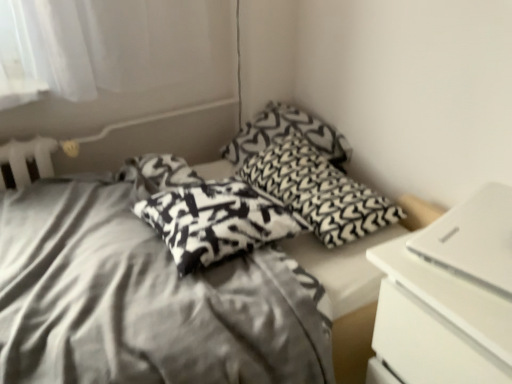
Describe the element at coordinates (318, 191) in the screenshot. I see `black and white patterned pillow at center, which ranks as the second pillow in back-to-front order` at that location.

What is the approximate width of silky fabric bed at center?

silky fabric bed at center is 1.01 meters in width.

Identify the location of black knitted pillow at center, placed as the third pillow when sorted from front to back. (286, 134).

Describe the element at coordinates (216, 221) in the screenshot. I see `black-and-white printed pillow at center, the third pillow from the back` at that location.

Locate an element on the screen. white matte laptop at right is located at coordinates (x=474, y=240).

Can you confirm if black knitted pillow at center, which is the 1th pillow in back-to-front order, is positioned to the left of black-and-white printed pillow at center, the third pillow from the back?

In fact, black knitted pillow at center, which is the 1th pillow in back-to-front order, is to the right of black-and-white printed pillow at center, the third pillow from the back.

Where is `pillow above the black-and-white printed pillow at center, acting as the 1th pillow starting from the front (from a real-world perspective)`? pillow above the black-and-white printed pillow at center, acting as the 1th pillow starting from the front (from a real-world perspective) is located at coordinates (286, 134).

From a real-world perspective, who is located higher, black knitted pillow at center, placed as the third pillow when sorted from front to back, or black-and-white printed pillow at center, acting as the 1th pillow starting from the front?

black knitted pillow at center, placed as the third pillow when sorted from front to back, is physically above.

Which of these two, black knitted pillow at center, which is the 1th pillow in back-to-front order, or black-and-white printed pillow at center, acting as the 1th pillow starting from the front, is smaller?

With smaller size is black-and-white printed pillow at center, acting as the 1th pillow starting from the front.

Which of these two, black-and-white printed pillow at center, acting as the 1th pillow starting from the front, or silky fabric bed at center, stands shorter?

With less height is black-and-white printed pillow at center, acting as the 1th pillow starting from the front.

From a real-world perspective, is black-and-white printed pillow at center, the third pillow from the back, under silky fabric bed at center?

No, from a real-world perspective, black-and-white printed pillow at center, the third pillow from the back, is not beneath silky fabric bed at center.

Which is in front, point (234, 223) or point (263, 302)?

Positioned in front is point (263, 302).

Is black-and-white printed pillow at center, acting as the 1th pillow starting from the front, wider than silky fabric bed at center?

In fact, black-and-white printed pillow at center, acting as the 1th pillow starting from the front, might be narrower than silky fabric bed at center.

From the image's perspective, is black-and-white printed pillow at center, the third pillow from the back, above black knitted pillow at center, placed as the third pillow when sorted from front to back?

Incorrect, from the image's perspective, black-and-white printed pillow at center, the third pillow from the back, is lower than black knitted pillow at center, placed as the third pillow when sorted from front to back.

From a real-world perspective, is black-and-white printed pillow at center, acting as the 1th pillow starting from the front, on top of black knitted pillow at center, which is the 1th pillow in back-to-front order?

No, from a real-world perspective, black-and-white printed pillow at center, acting as the 1th pillow starting from the front, is not on top of black knitted pillow at center, which is the 1th pillow in back-to-front order.

In the scene shown: Is black-and-white printed pillow at center, the third pillow from the back, completely or partially outside of black knitted pillow at center, which is the 1th pillow in back-to-front order?

Yes, black-and-white printed pillow at center, the third pillow from the back, is not within black knitted pillow at center, which is the 1th pillow in back-to-front order.

Is black-and-white printed pillow at center, the third pillow from the back, looking in the opposite direction of black knitted pillow at center, which is the 1th pillow in back-to-front order?

That's not correct — black-and-white printed pillow at center, the third pillow from the back, is not looking away from black knitted pillow at center, which is the 1th pillow in back-to-front order.

Considering the sizes of objects silky fabric bed at center and white matte laptop at right in the image provided, who is smaller, silky fabric bed at center or white matte laptop at right?

Smaller between the two is white matte laptop at right.

Are silky fabric bed at center and white matte laptop at right far apart?

No, silky fabric bed at center is not far away from white matte laptop at right.

You are a GUI agent. You are given a task and a screenshot of the screen. Output one action in this format:
    pyautogui.click(x=<x>, y=<y>)
    Task: Click on the computer that is behind the silky fabric bed at center
    The height and width of the screenshot is (384, 512).
    Given the screenshot: What is the action you would take?
    point(474,240)

Considering their positions, is silky fabric bed at center located in front of or behind white matte laptop at right?

silky fabric bed at center is in front of white matte laptop at right.

Which of these two, black knitted pillow at center, placed as the third pillow when sorted from front to back, or black and white patterned pillow at center, the 2th pillow when ordered from front to back, is thinner?

With smaller width is black knitted pillow at center, placed as the third pillow when sorted from front to back.

Is black and white patterned pillow at center, the 2th pillow when ordered from front to back, a part of black knitted pillow at center, placed as the third pillow when sorted from front to back?

No, black and white patterned pillow at center, the 2th pillow when ordered from front to back, is not inside black knitted pillow at center, placed as the third pillow when sorted from front to back.

From a real-world perspective, is black knitted pillow at center, placed as the third pillow when sorted from front to back, physically located above or below black and white patterned pillow at center, the 2th pillow when ordered from front to back?

black knitted pillow at center, placed as the third pillow when sorted from front to back, is situated higher than black and white patterned pillow at center, the 2th pillow when ordered from front to back, in the real world.

Is black and white patterned pillow at center, the 2th pillow when ordered from front to back, inside or outside of black knitted pillow at center, which is the 1th pillow in back-to-front order?

black and white patterned pillow at center, the 2th pillow when ordered from front to back, is outside black knitted pillow at center, which is the 1th pillow in back-to-front order.

Between black and white patterned pillow at center, which ranks as the second pillow in back-to-front order, and black knitted pillow at center, placed as the third pillow when sorted from front to back, which one has larger width?

black and white patterned pillow at center, which ranks as the second pillow in back-to-front order, is wider.

Which object is closer to the camera taking this photo, black and white patterned pillow at center, the 2th pillow when ordered from front to back, or black knitted pillow at center, which is the 1th pillow in back-to-front order?

black and white patterned pillow at center, the 2th pillow when ordered from front to back, is more forward.

Where is `pillow located on the right of black knitted pillow at center, placed as the third pillow when sorted from front to back`? The height and width of the screenshot is (384, 512). pillow located on the right of black knitted pillow at center, placed as the third pillow when sorted from front to back is located at coordinates (318, 191).

Which point is more distant from viewer, (436, 252) or (252, 127)?

The point (252, 127) is more distant.

Considering the positions of objects white matte laptop at right and black knitted pillow at center, which is the 1th pillow in back-to-front order, in the image provided, who is in front, white matte laptop at right or black knitted pillow at center, which is the 1th pillow in back-to-front order,?

white matte laptop at right is closer to the camera.

Would you say white matte laptop at right contains black knitted pillow at center, placed as the third pillow when sorted from front to back?

No, white matte laptop at right does not contain black knitted pillow at center, placed as the third pillow when sorted from front to back.

From a real-world perspective, is white matte laptop at right beneath black knitted pillow at center, which is the 1th pillow in back-to-front order?

Incorrect, from a real-world perspective, white matte laptop at right is higher than black knitted pillow at center, which is the 1th pillow in back-to-front order.

Where is `the 2nd pillow below the black knitted pillow at center, placed as the third pillow when sorted from front to back (from the image's perspective)`? The image size is (512, 384). the 2nd pillow below the black knitted pillow at center, placed as the third pillow when sorted from front to back (from the image's perspective) is located at coordinates tap(216, 221).

Find the location of a particular element. Image resolution: width=512 pixels, height=384 pixels. bed located in front of the black-and-white printed pillow at center, acting as the 1th pillow starting from the front is located at coordinates (143, 300).

Based on the photo, which object lies further to the anchor point white matte laptop at right, black knitted pillow at center, which is the 1th pillow in back-to-front order, or black-and-white printed pillow at center, the third pillow from the back?

black knitted pillow at center, which is the 1th pillow in back-to-front order, is positioned further to the anchor white matte laptop at right.

Considering their positions, is black and white patterned pillow at center, the 2th pillow when ordered from front to back, positioned closer to black knitted pillow at center, placed as the third pillow when sorted from front to back, than silky fabric bed at center?

black and white patterned pillow at center, the 2th pillow when ordered from front to back, lies closer to black knitted pillow at center, placed as the third pillow when sorted from front to back, than the other object.

Estimate the real-world distances between objects in this image. Which object is closer to black and white patterned pillow at center, the 2th pillow when ordered from front to back, white matte laptop at right or black knitted pillow at center, which is the 1th pillow in back-to-front order?

black knitted pillow at center, which is the 1th pillow in back-to-front order, lies closer to black and white patterned pillow at center, the 2th pillow when ordered from front to back, than the other object.

From the picture: Which object lies further to the anchor point black knitted pillow at center, which is the 1th pillow in back-to-front order, black-and-white printed pillow at center, the third pillow from the back, or black and white patterned pillow at center, which ranks as the second pillow in back-to-front order?

The object further to black knitted pillow at center, which is the 1th pillow in back-to-front order, is black-and-white printed pillow at center, the third pillow from the back.

From the image, which object appears to be nearer to black-and-white printed pillow at center, the third pillow from the back, black knitted pillow at center, which is the 1th pillow in back-to-front order, or silky fabric bed at center?

silky fabric bed at center.

Which object lies further to the anchor point silky fabric bed at center, black knitted pillow at center, which is the 1th pillow in back-to-front order, or white matte laptop at right?

Among the two, black knitted pillow at center, which is the 1th pillow in back-to-front order, is located further to silky fabric bed at center.

Looking at the image, which one is located further to black and white patterned pillow at center, the 2th pillow when ordered from front to back, white matte laptop at right or silky fabric bed at center?

The object further to black and white patterned pillow at center, the 2th pillow when ordered from front to back, is white matte laptop at right.

Based on their spatial positions, is white matte laptop at right or black-and-white printed pillow at center, the third pillow from the back, closer to black and white patterned pillow at center, which ranks as the second pillow in back-to-front order?

black-and-white printed pillow at center, the third pillow from the back, lies closer to black and white patterned pillow at center, which ranks as the second pillow in back-to-front order, than the other object.

The width and height of the screenshot is (512, 384). I want to click on pillow between silky fabric bed at center and black and white patterned pillow at center, the 2th pillow when ordered from front to back, from front to back, so click(x=216, y=221).

Identify the location of computer located between silky fabric bed at center and black knitted pillow at center, which is the 1th pillow in back-to-front order, in the depth direction. (474, 240).

The image size is (512, 384). I want to click on pillow located between black-and-white printed pillow at center, acting as the 1th pillow starting from the front, and black knitted pillow at center, which is the 1th pillow in back-to-front order, in the depth direction, so click(318, 191).